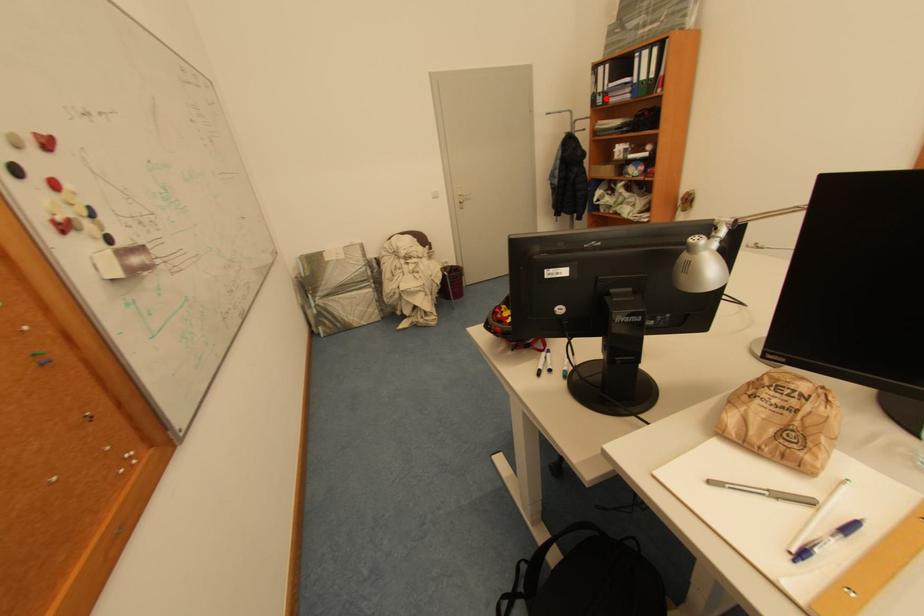
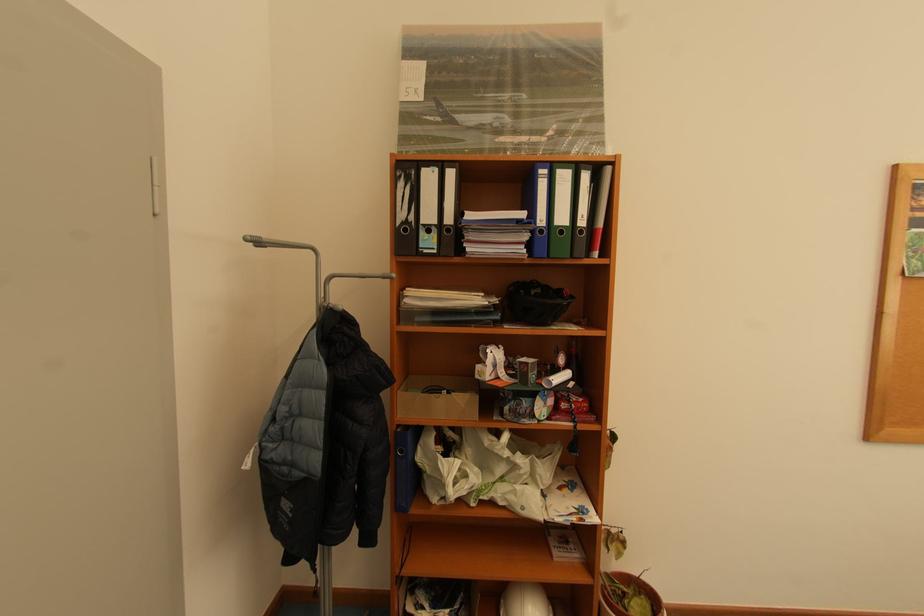
Where in the second image is the point corresponding to the highlighted location from the first image?

(431, 235)